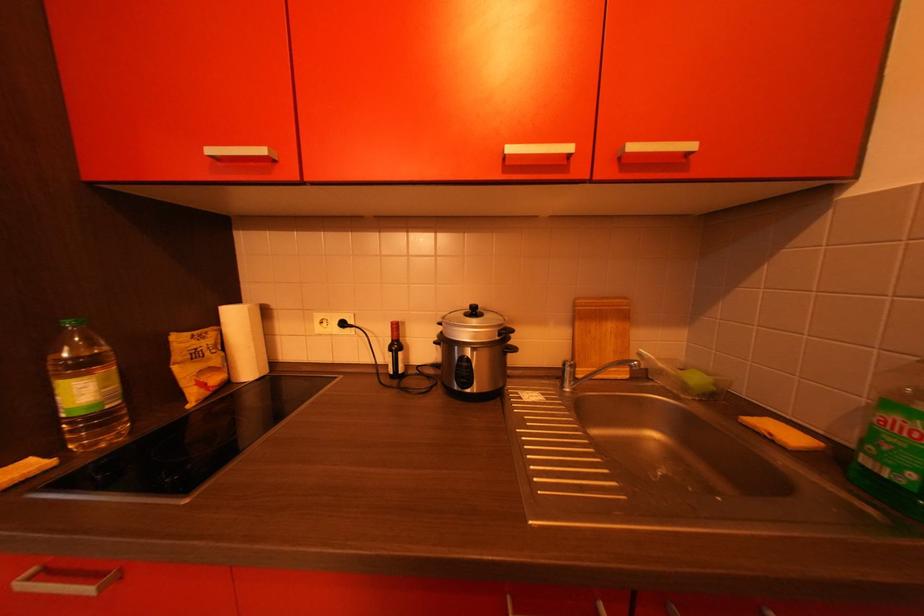
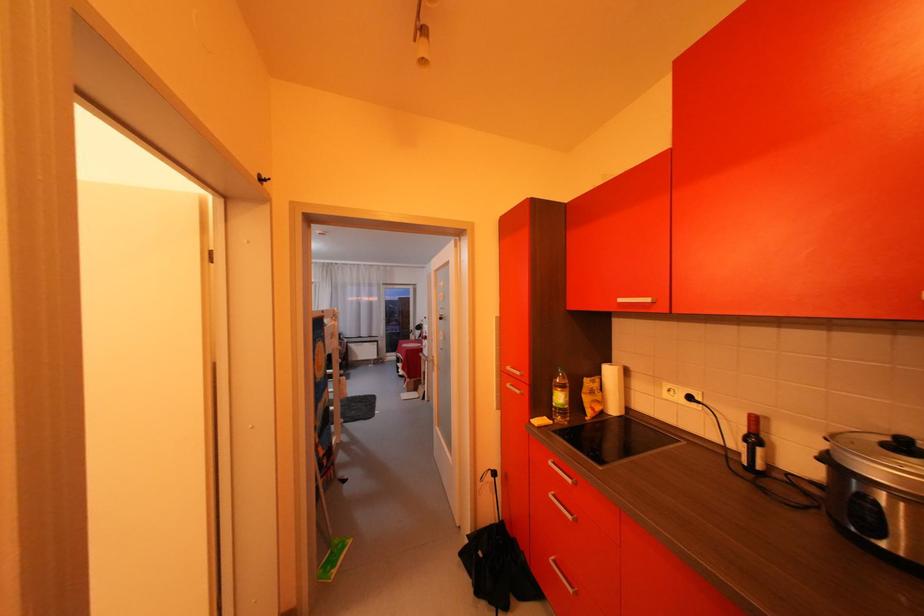
In the second image, find the point that corresponds to (x=43, y=460) in the first image.

(556, 419)